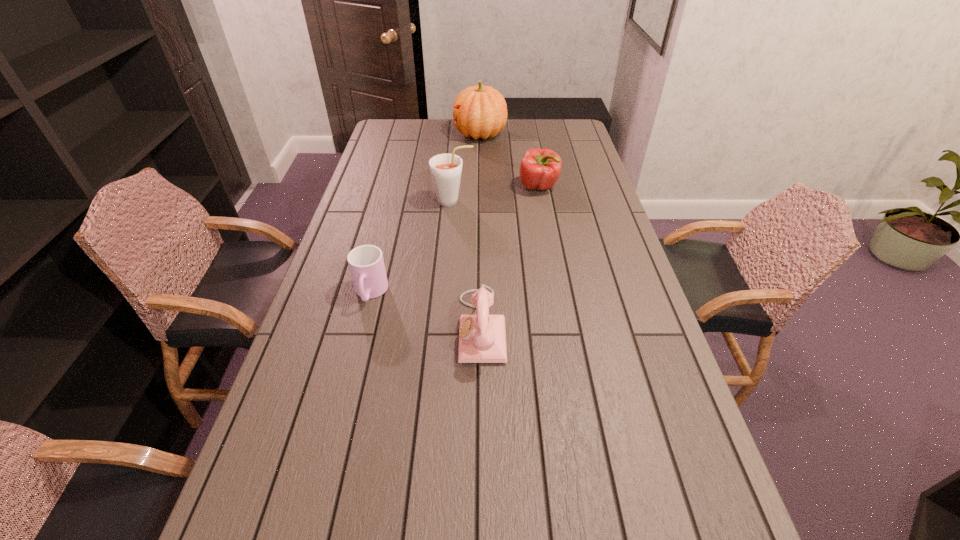
At what (x,y) coordinates should I click in order to perform the action: click on vacant space that is in between the farthest object and the fourth shortest object. Please return your answer as a coordinate pair (x, y). The height and width of the screenshot is (540, 960). Looking at the image, I should click on (467, 168).

Point out which object is positioned as the fourth nearest to the rightmost object. Please provide its 2D coordinates. Your answer should be formatted as a tuple, i.e. [(x, y)], where the tuple contains the x and y coordinates of a point satisfying the conditions above.

[(366, 263)]

Identify which object is the closest to the fourth shortest object. Please provide its 2D coordinates. Your answer should be formatted as a tuple, i.e. [(x, y)], where the tuple contains the x and y coordinates of a point satisfying the conditions above.

[(540, 168)]

Locate an element on the screen. The width and height of the screenshot is (960, 540). vacant area that satisfies the following two spatial constraints: 1. on the carved face of the pumpkin; 2. on the right side of the rightmost object is located at coordinates (480, 187).